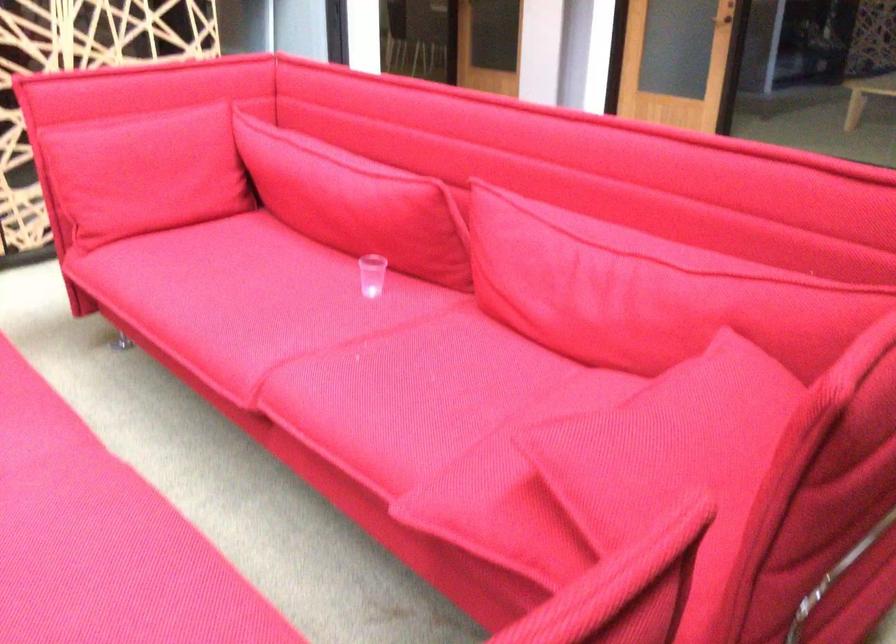
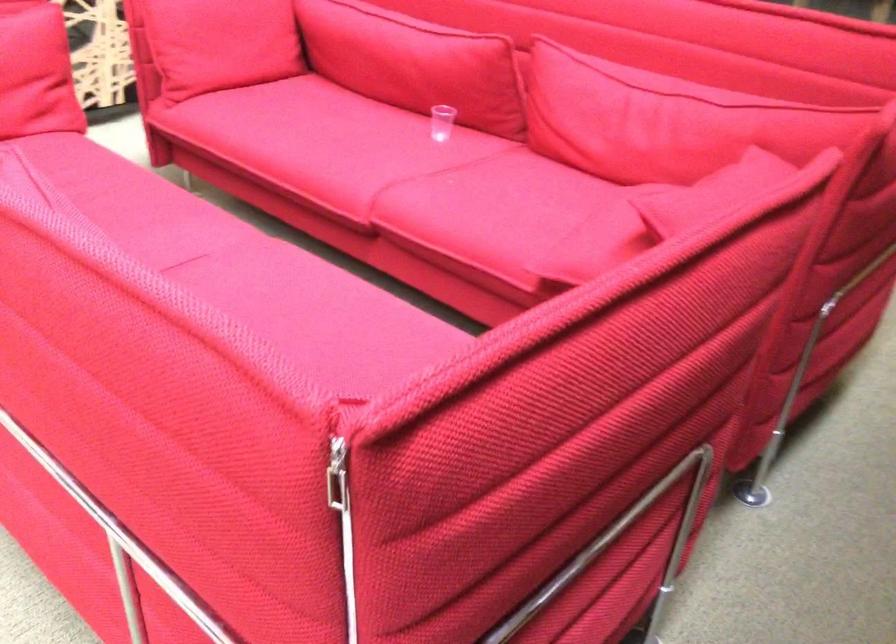
Question: I am providing you with two images of the same scene from different viewpoints. Which of the following objects are not visible in image2?

Choices:
 (A) red sofa cushion
 (B) silver zipper pull
 (C) red sofa armrest
 (D) none of these

Answer: (D)